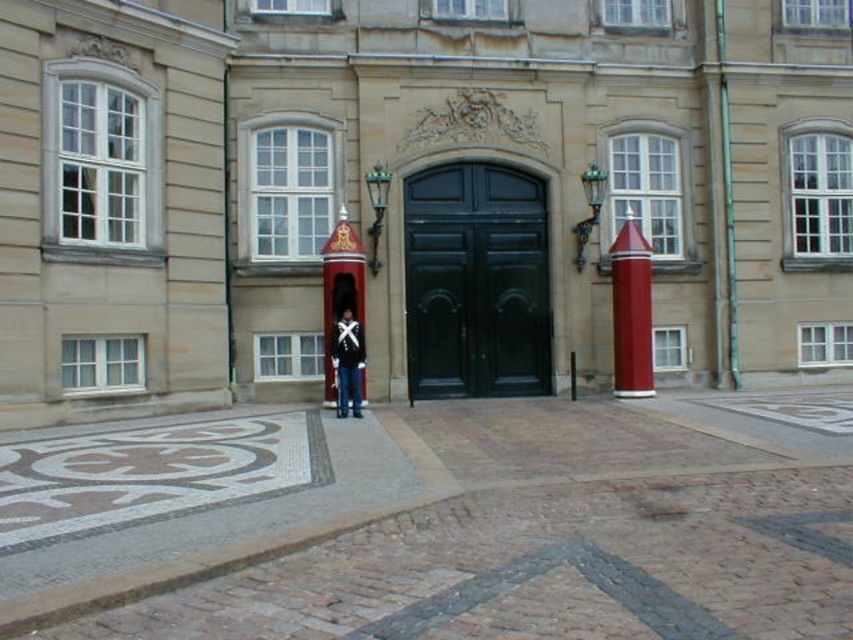
You are standing in front of the smooth stone palace at center and want to enter through the green polished wood door at center. Which direction should you move to get closer to the door?

Since the smooth stone palace at center is closer to the viewer than the green polished wood door at center, you should move forward towards the door to get closer to it.

You are a visitor approaching the grand entrance of the building. You notice the smooth red pillar at center right and the uniformed man at center. Which object is positioned higher relative to the other?

The smooth red pillar at center right is located above the uniformed man at center, so it is positioned higher.